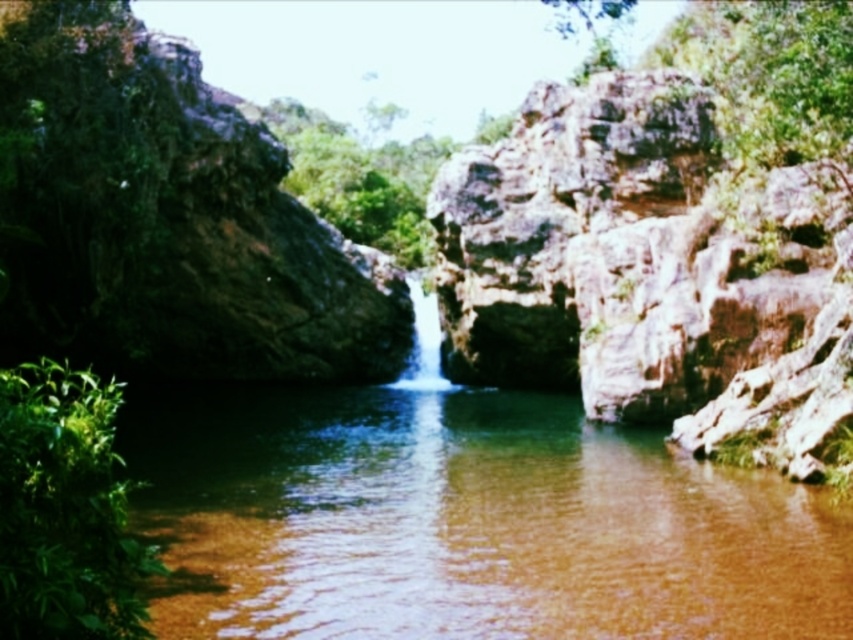
Is brown smooth river at center shorter than green leafy plant at lower left?

Yes.

How much distance is there between brown smooth river at center and green leafy plant at lower left?

brown smooth river at center and green leafy plant at lower left are 16.11 meters apart.

At what (x,y) coordinates should I click in order to perform the action: click on brown smooth river at center. Please return your answer as a coordinate pair (x, y). This screenshot has width=853, height=640. Looking at the image, I should click on (462, 522).

Does brown smooth river at center appear over white smooth waterfall at center?

Actually, brown smooth river at center is below white smooth waterfall at center.

Locate an element on the screen. brown smooth river at center is located at coordinates (462, 522).

The height and width of the screenshot is (640, 853). In order to click on brown smooth river at center in this screenshot , I will do `click(462, 522)`.

Does green leafy plant at lower left appear on the left side of white smooth waterfall at center?

Yes, green leafy plant at lower left is to the left of white smooth waterfall at center.

Does green leafy plant at lower left have a lesser width compared to white smooth waterfall at center?

Incorrect, green leafy plant at lower left's width is not less than white smooth waterfall at center's.

Is point (97, 470) positioned behind point (436, 356)?

No, (97, 470) is in front of (436, 356).

The width and height of the screenshot is (853, 640). I want to click on green leafy plant at lower left, so click(64, 509).